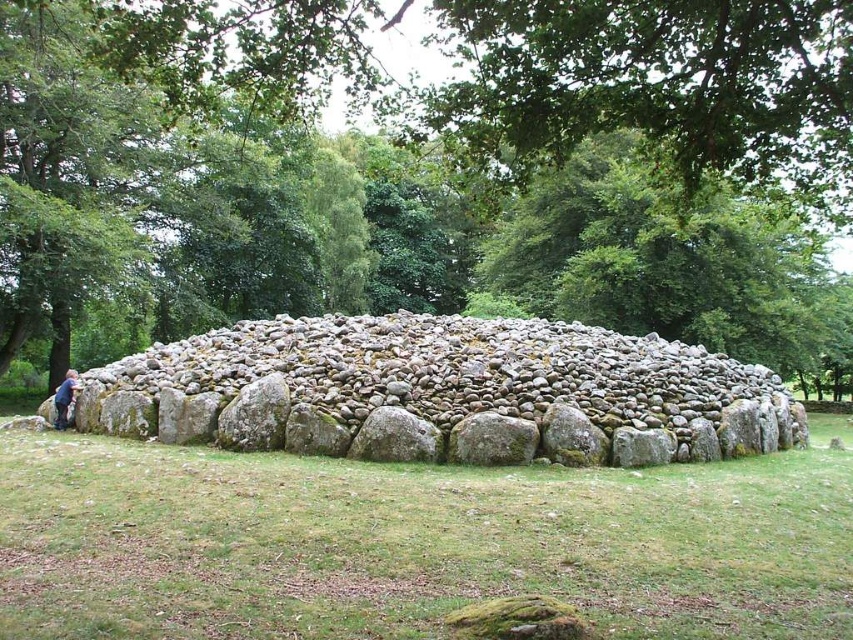
Who is higher up, green leafy tree at center or smooth gray rock at center?

A: green leafy tree at center

At what (x,y) coordinates should I click in order to perform the action: click on green leafy tree at center. Please return your answer as a coordinate pair (x, y). Looking at the image, I should click on (428, 172).

Is point (305, 161) positioned before point (384, 442)?

That is False.

Where is `green leafy tree at center`? green leafy tree at center is located at coordinates (428, 172).

Does green grass at lower center have a lesser width compared to dark brown leather jacket at lower left?

In fact, green grass at lower center might be wider than dark brown leather jacket at lower left.

This screenshot has width=853, height=640. In order to click on green grass at lower center in this screenshot , I will do 415,541.

Can you confirm if green grass at lower center is positioned above smooth gray rock at center?

No.

Is green grass at lower center to the right of smooth gray rock at center from the viewer's perspective?

Incorrect, green grass at lower center is not on the right side of smooth gray rock at center.

Who is more distant from viewer, (421, 493) or (682, 392)?

The point (682, 392) is more distant.

Where is `green grass at lower center`? This screenshot has width=853, height=640. green grass at lower center is located at coordinates (415, 541).